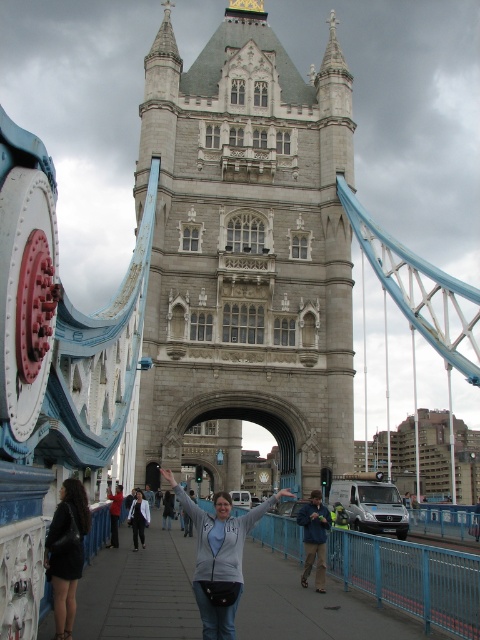
Question: Which of these objects is positioned farthest from the gray fleece jacket at center?

Choices:
 (A) black leather jacket at lower left
 (B) gray stone tower at center
 (C) light gray sweater at center

Answer: (B)

Question: Is gray stone tower at center positioned in front of black leather jacket at lower left?

Choices:
 (A) yes
 (B) no

Answer: (B)

Question: Is gray stone tower at center thinner than black leather jacket at lower left?

Choices:
 (A) no
 (B) yes

Answer: (A)

Question: Which object appears closest to the camera in this image?

Choices:
 (A) black leather jacket at lower left
 (B) gray fleece jacket at center

Answer: (A)

Question: Is gray stone tower at center further to the viewer compared to light gray sweater at center?

Choices:
 (A) yes
 (B) no

Answer: (A)

Question: Based on their relative distances, which object is nearer to the gray stone tower at center?

Choices:
 (A) gray fleece jacket at center
 (B) light gray sweater at center
 (C) black leather jacket at lower left

Answer: (B)